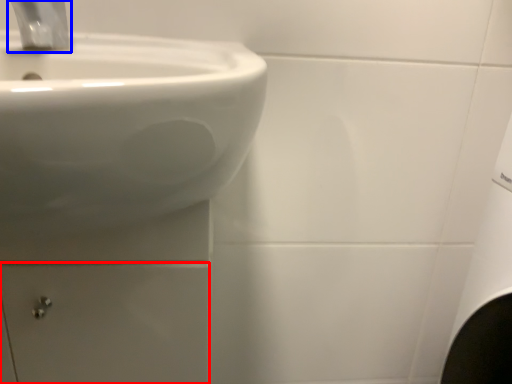
Question: Which object appears closest to the camera in this image, drawer (highlighted by a red box) or tap (highlighted by a blue box)?

Choices:
 (A) drawer
 (B) tap

Answer: (B)